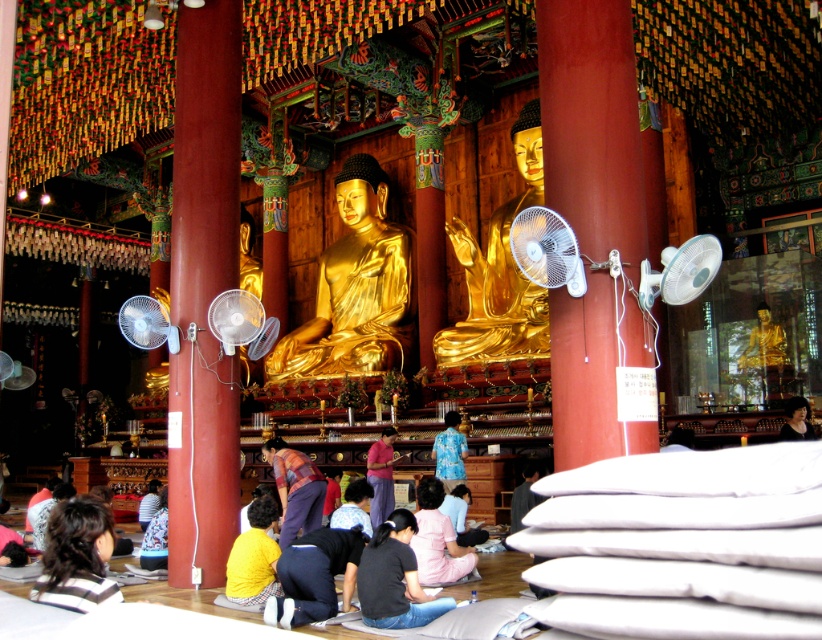
Does black fabric at lower center have a greater height compared to blue floral shirt at center?

Incorrect, black fabric at lower center's height is not larger of blue floral shirt at center's.

Is point (384, 627) positioned in front of point (459, 435)?

Yes.

Between point (388, 621) and point (450, 420), which one is positioned behind?

The point (450, 420) is more distant.

At what (x,y) coordinates should I click in order to perform the action: click on black fabric at lower center. Please return your answer as a coordinate pair (x, y). Image resolution: width=822 pixels, height=640 pixels. Looking at the image, I should click on (395, 579).

Can you confirm if blue floral shirt at center is bigger than yellow shirt at lower center?

Actually, blue floral shirt at center might be smaller than yellow shirt at lower center.

The image size is (822, 640). I want to click on blue floral shirt at center, so click(449, 452).

Where is `blue floral shirt at center`? The height and width of the screenshot is (640, 822). blue floral shirt at center is located at coordinates (449, 452).

Can you confirm if plaid fabric shirt at center is smaller than dark brown hair at lower right?

Incorrect, plaid fabric shirt at center is not smaller in size than dark brown hair at lower right.

Between plaid fabric shirt at center and dark brown hair at lower right, which one appears on the right side from the viewer's perspective?

From the viewer's perspective, dark brown hair at lower right appears more on the right side.

Where is `plaid fabric shirt at center`? The width and height of the screenshot is (822, 640). plaid fabric shirt at center is located at coordinates (294, 488).

You are a GUI agent. You are given a task and a screenshot of the screen. Output one action in this format:
    pyautogui.click(x=<x>, y=<y>)
    Task: Click on the plaid fabric shirt at center
    The height and width of the screenshot is (640, 822).
    Given the screenshot: What is the action you would take?
    pyautogui.click(x=294, y=488)